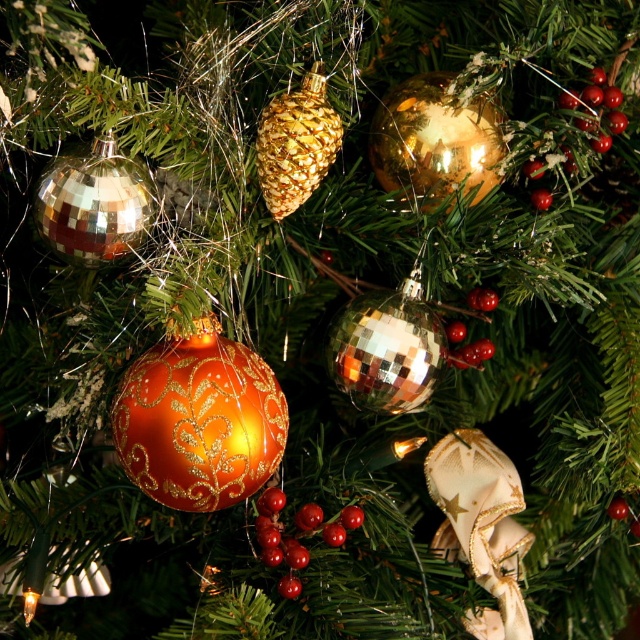
Does glossy red berry at center appear over glossy red berry at upper right?

Actually, glossy red berry at center is below glossy red berry at upper right.

Does point (481, 310) come in front of point (540, 211)?

No, (481, 310) is behind (540, 211).

What do you see at coordinates (481, 298) in the screenshot? I see `glossy red berry at center` at bounding box center [481, 298].

The width and height of the screenshot is (640, 640). I want to click on glossy red berry at center, so click(481, 298).

Can you confirm if gold textured pine cone at center is shorter than glossy red berry at upper right?

No.

Between point (296, 108) and point (541, 196), which one is positioned in front?

Point (296, 108) is in front.

Is point (275, 193) farther from viewer compared to point (531, 195)?

No, it is not.

Identify the location of gold textured pine cone at center. (296, 144).

Is shiny red berries at center to the right of glossy red berry at upper right from the viewer's perspective?

In fact, shiny red berries at center is to the left of glossy red berry at upper right.

What do you see at coordinates (296, 534) in the screenshot? I see `shiny red berries at center` at bounding box center [296, 534].

This screenshot has width=640, height=640. What do you see at coordinates (296, 534) in the screenshot?
I see `shiny red berries at center` at bounding box center [296, 534].

Identify the location of shiny red berries at center. This screenshot has height=640, width=640. (296, 534).